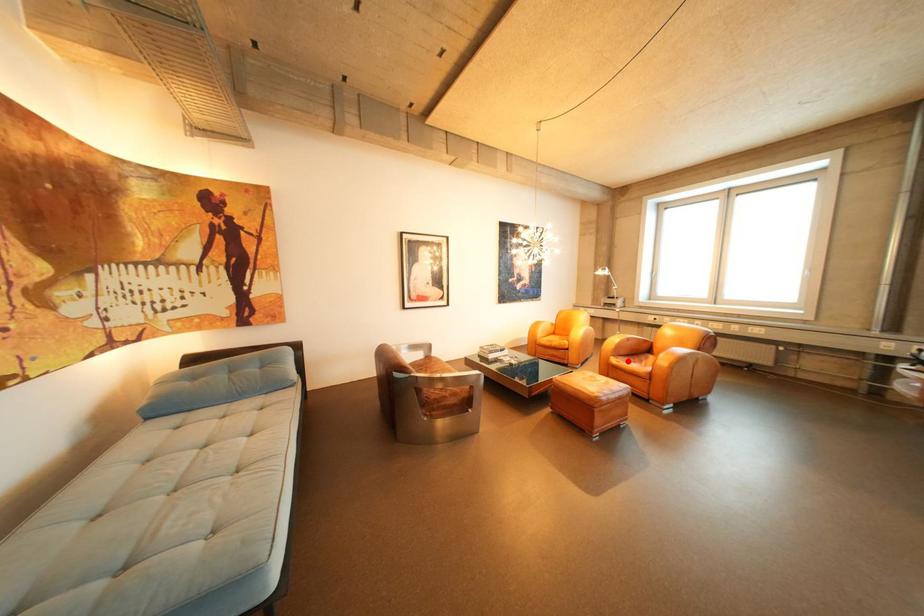
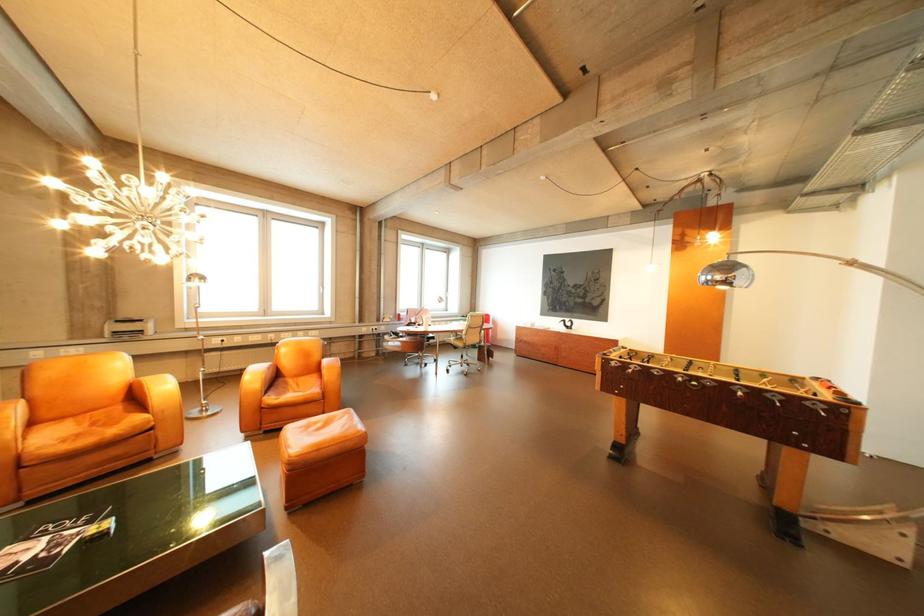
Find the pixel in the second image that matches the highlighted location in the first image.

(285, 400)